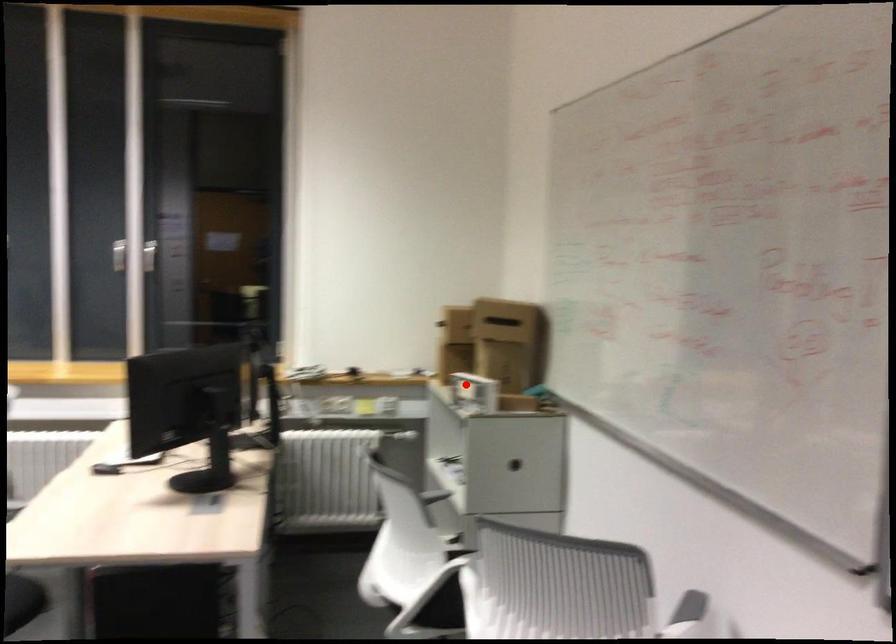
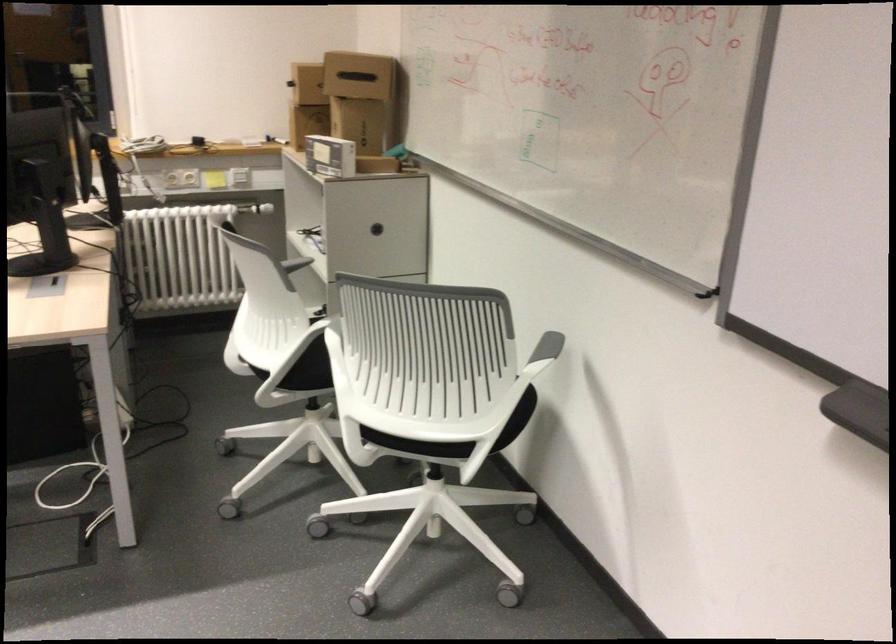
Locate, in the second image, the point that corresponds to the highlighted location in the first image.

(330, 156)